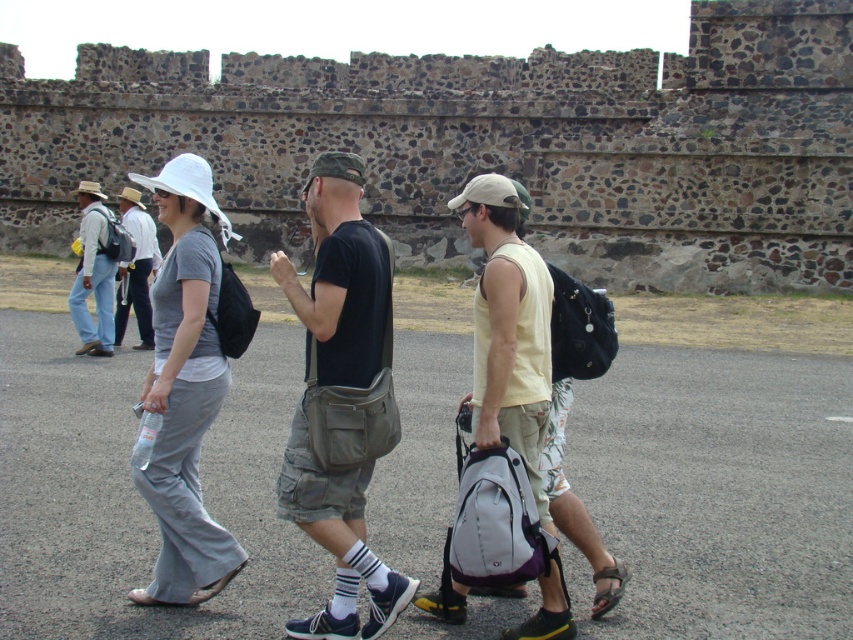
Question: Which object is farther from the camera taking this photo?

Choices:
 (A) white fabric baseball hat at upper left
 (B) olive green canvas shoulder bag at center
 (C) white matte baseball hat at upper left

Answer: (C)

Question: Which object is farther from the camera taking this photo?

Choices:
 (A) dark gray cotton t-shirt at center
 (B) olive green canvas shoulder bag at center
 (C) matte black backpack at center-right

Answer: (C)

Question: Is yellow cotton tank top at center closer to camera compared to white matte baseball hat at upper left?

Choices:
 (A) yes
 (B) no

Answer: (A)

Question: Does matte black backpack at center-right appear on the right side of white matte baseball hat at upper left?

Choices:
 (A) no
 (B) yes

Answer: (B)

Question: Which point is farther from the camera taking this photo?

Choices:
 (A) (349, 163)
 (B) (91, 252)
 (C) (479, 196)
 (D) (370, 193)

Answer: (D)

Question: Observing the image, what is the correct spatial positioning of light blue denim jeans at left in reference to camouflage fabric baseball cap at center?

Choices:
 (A) right
 (B) left

Answer: (B)